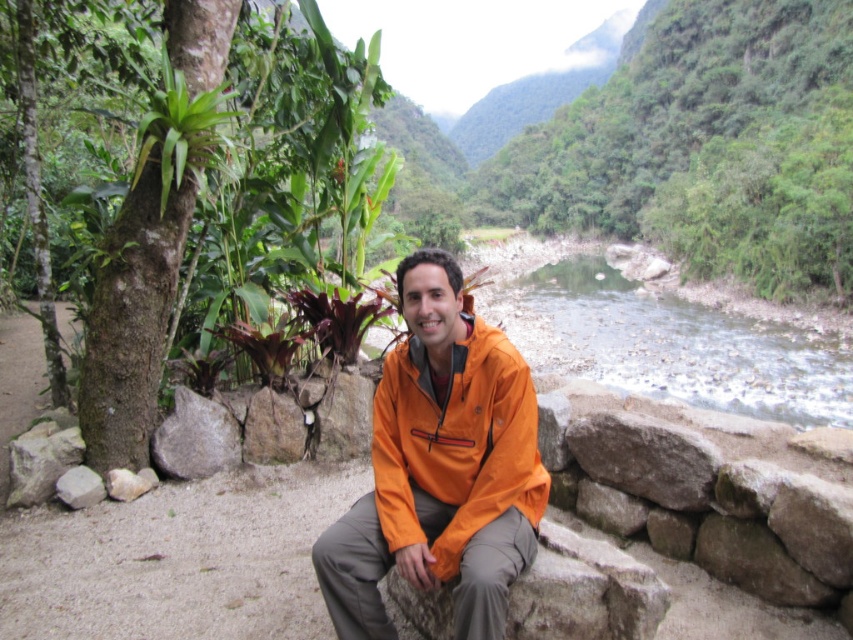
Question: Is the position of orange waterproof jacket at center more distant than that of clear water at river right?

Choices:
 (A) yes
 (B) no

Answer: (B)

Question: Which point is closer to the camera?

Choices:
 (A) (430, 339)
 (B) (850, 412)

Answer: (A)

Question: Can you confirm if orange waterproof jacket at center is bigger than clear water at river right?

Choices:
 (A) yes
 (B) no

Answer: (B)

Question: Among these points, which one is farthest from the camera?

Choices:
 (A) (424, 257)
 (B) (827, 346)

Answer: (B)

Question: Is orange waterproof jacket at center further to the viewer compared to clear water at river right?

Choices:
 (A) no
 (B) yes

Answer: (A)